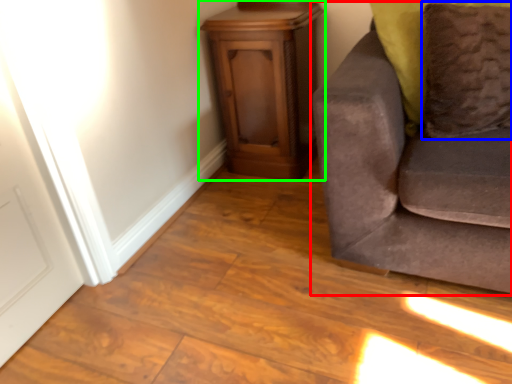
Question: Considering the real-world distances, which object is farthest from studio couch (highlighted by a red box)? pillow (highlighted by a blue box) or furniture (highlighted by a green box)?

Choices:
 (A) pillow
 (B) furniture

Answer: (B)